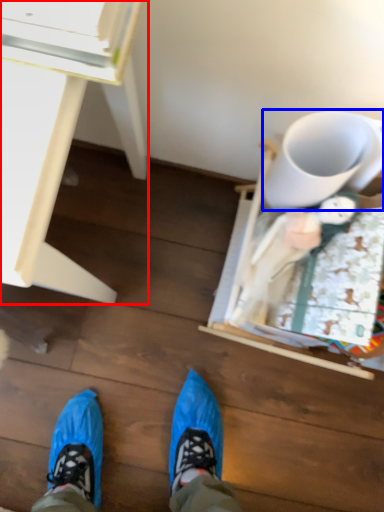
Question: Which object is further to the camera taking this photo, desk (highlighted by a red box) or mug (highlighted by a blue box)?

Choices:
 (A) desk
 (B) mug

Answer: (B)